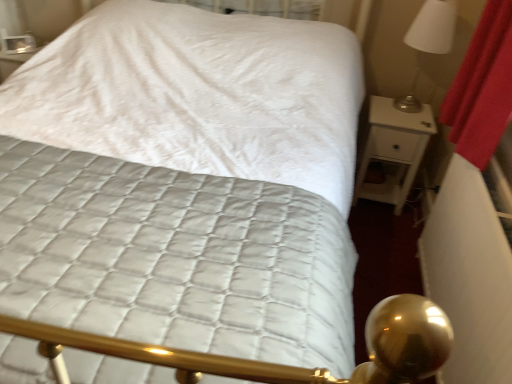
Locate an element on the screen. This screenshot has width=512, height=384. vacant space situated above white glossy nightstand at right (from a real-world perspective) is located at coordinates (392, 106).